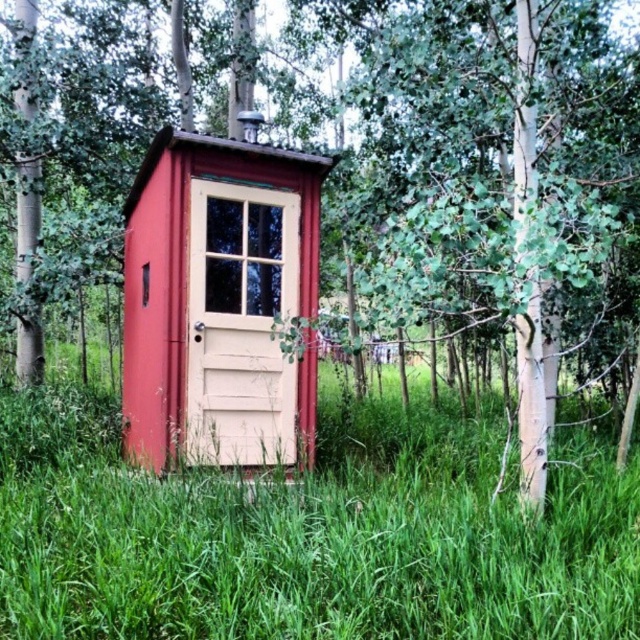
Based on the photo, between green grass at center and matte wood cabin at center, which one has more height?

matte wood cabin at center is taller.

Which is below, green grass at center or matte wood cabin at center?

green grass at center

Find the location of `green grass at center`. green grass at center is located at coordinates (310, 532).

The width and height of the screenshot is (640, 640). Identify the location of green grass at center. (310, 532).